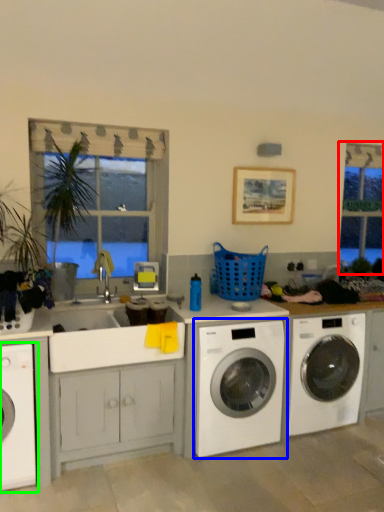
Question: Based on their relative distances, which object is nearer to bay window (highlighted by a red box)? Choose from washing machine (highlighted by a blue box) and washing machine (highlighted by a green box).

Choices:
 (A) washing machine
 (B) washing machine

Answer: (A)